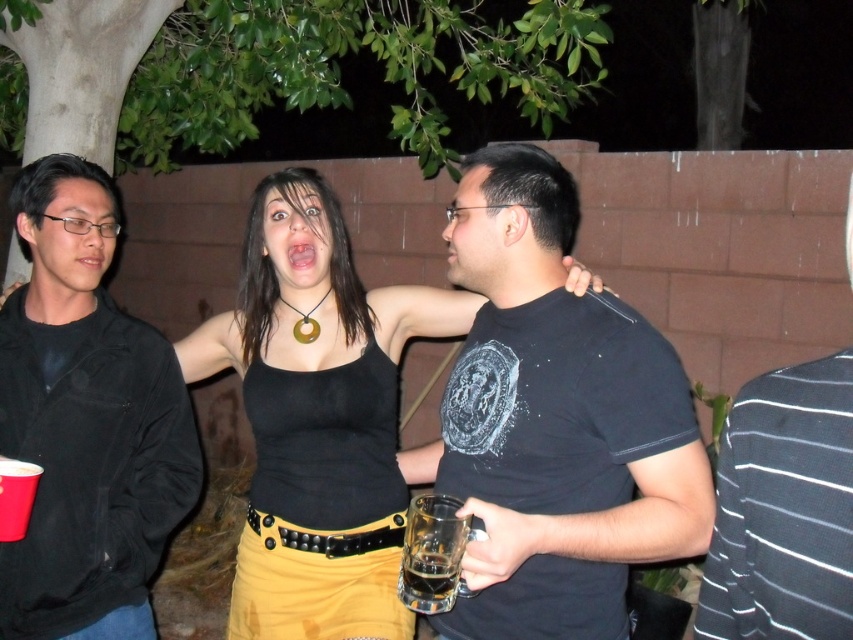
Looking at this image, who is more distant from viewer, (x=102, y=220) or (x=444, y=586)?

Point (x=102, y=220)

Does matte black jacket at left lie in front of translucent glass at center?

No.

Does point (55, 240) come behind point (405, 564)?

Yes, it is behind point (405, 564).

Where is `matte black jacket at left`? Image resolution: width=853 pixels, height=640 pixels. matte black jacket at left is located at coordinates (86, 420).

Who is more distant from viewer, (448, 586) or (405, 573)?

Positioned behind is point (405, 573).

Where is `transparent glass at center`? This screenshot has height=640, width=853. transparent glass at center is located at coordinates (433, 554).

The image size is (853, 640). I want to click on transparent glass at center, so click(433, 554).

Is black matte t-shirt at center positioned at the back of transparent glass at center?

That is True.

Between point (535, 316) and point (415, 538), which one is positioned behind?

The point (535, 316) is more distant.

Find the location of a particular element. black matte t-shirt at center is located at coordinates (x=555, y=420).

This screenshot has width=853, height=640. Find the location of `black matte t-shirt at center`. black matte t-shirt at center is located at coordinates (555, 420).